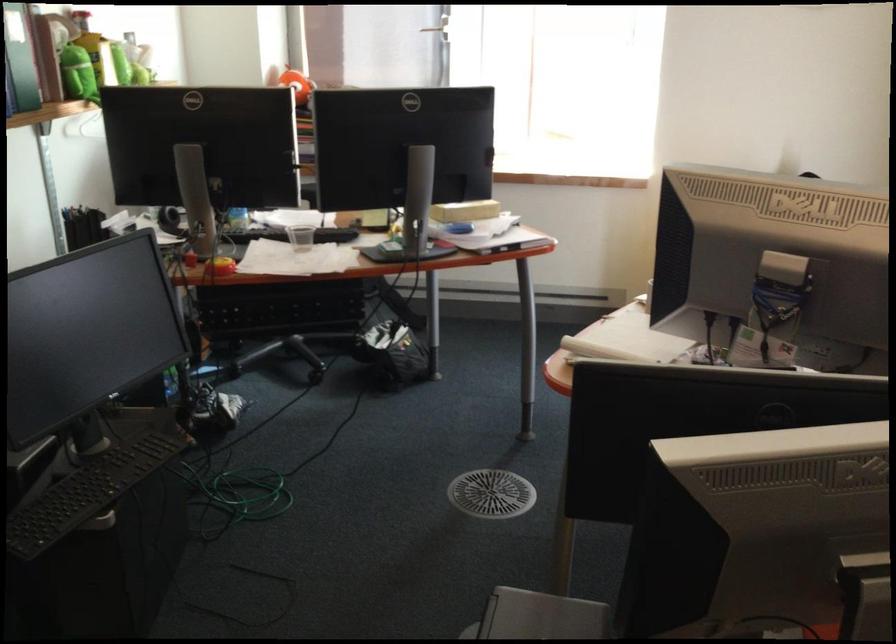
Locate an element on the screen. This screenshot has height=644, width=896. orange ball toy is located at coordinates (297, 84).